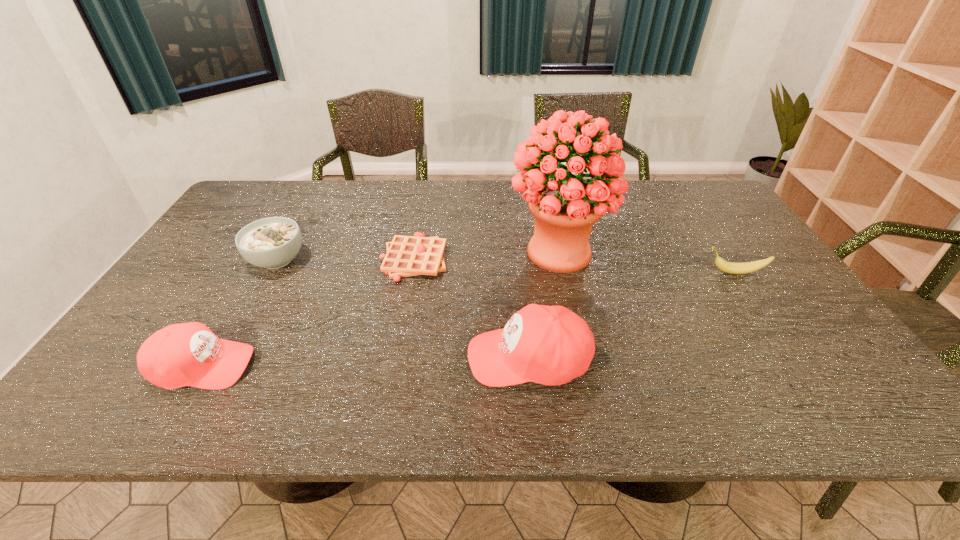
This screenshot has height=540, width=960. In order to click on free space located 0.320m on the front panel of the right baseball cap in this screenshot , I will do `click(327, 358)`.

Where is `vacant space positioned 0.270m on the front panel of the right baseball cap`? vacant space positioned 0.270m on the front panel of the right baseball cap is located at coordinates (349, 358).

At what (x,y) coordinates should I click in order to perform the action: click on free space located on the front panel of the right baseball cap. Please return your answer as a coordinate pair (x, y). This screenshot has width=960, height=540. Looking at the image, I should click on (324, 358).

Where is `vacant space located on the left of the fourth object from right to left`? The width and height of the screenshot is (960, 540). vacant space located on the left of the fourth object from right to left is located at coordinates (352, 259).

Locate an element on the screen. This screenshot has width=960, height=540. free space located on the left of the bouquet is located at coordinates (470, 251).

Identify the location of free space located at the stem of the banana. This screenshot has width=960, height=540. (631, 273).

Where is `vacant area situated at the stem of the banana`? The width and height of the screenshot is (960, 540). vacant area situated at the stem of the banana is located at coordinates (656, 273).

Find the location of a particular element. Image resolution: width=960 pixels, height=540 pixels. free spot located at the stem of the banana is located at coordinates (595, 273).

You are a GUI agent. You are given a task and a screenshot of the screen. Output one action in this format:
    pyautogui.click(x=<x>, y=<y>)
    Task: Click on the free region located 0.070m on the back of the soup bowl
    
    Given the screenshot: What is the action you would take?
    pyautogui.click(x=294, y=230)

In order to click on object that is at the left edge in this screenshot , I will do `click(188, 354)`.